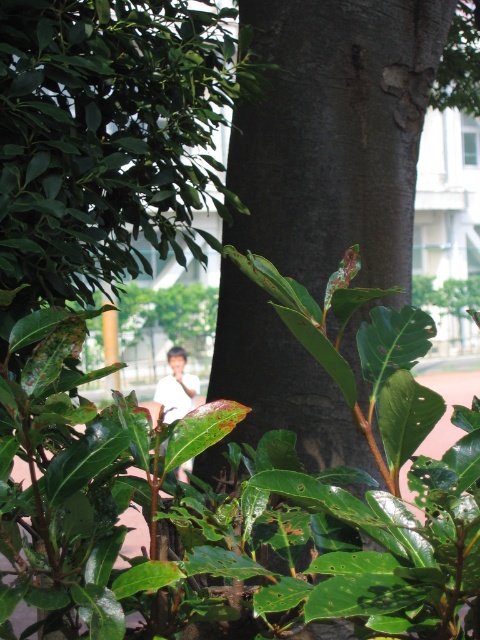
You are a gardener standing at the base of the tree trunk. You see two points marked on the tree trunk at coordinates point (348, 148) and point (168, 362). Which point is closer to you?

Point (348, 148) is in front of point (168, 362), so it is closer to you.

You are a photographer standing at a certain distance from the dark brown rough tree trunk at center. You want to capture a closeup shot of the trunk while ensuring the entire trunk fits in the frame. Your camera has a minimum focusing distance of 4 meters. Will you be able to take the photo without moving closer?

The distance between the dark brown rough tree trunk at center and the camera is 3.93 meters, which is less than the camera minimum focusing distance of 4 meters. Therefore, you cannot take the photo without moving further back to at least 4 meters away.